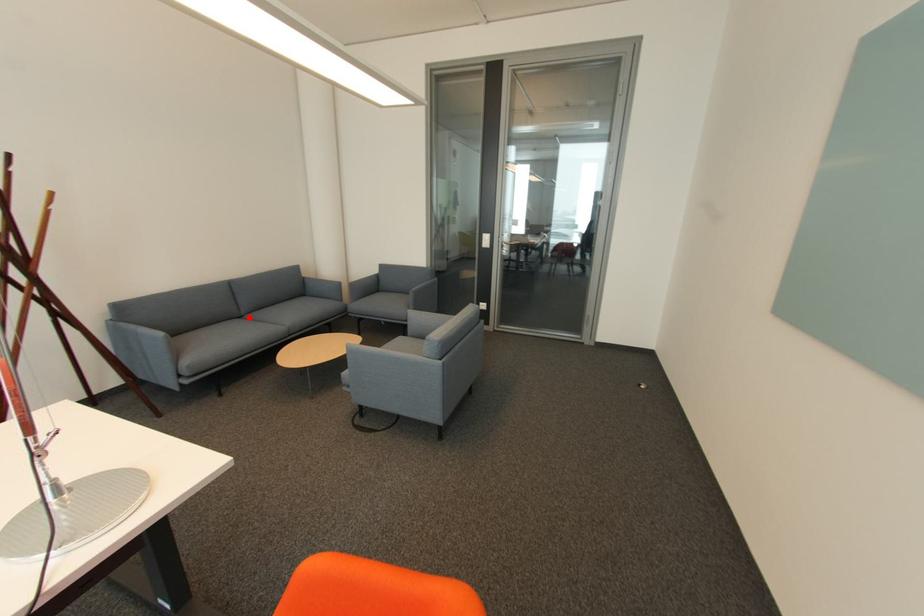
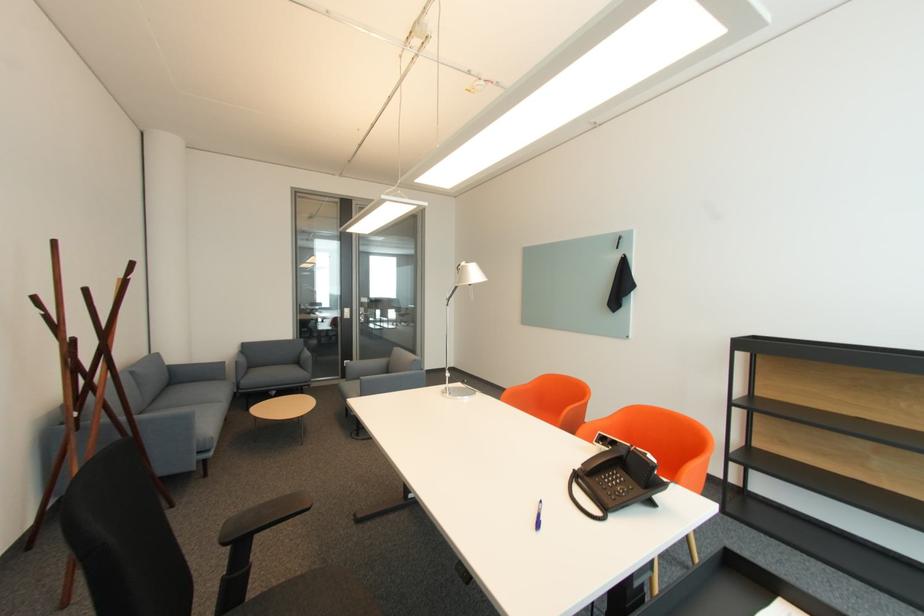
Find the pixel in the second image that matches the highlighted location in the first image.

(151, 411)